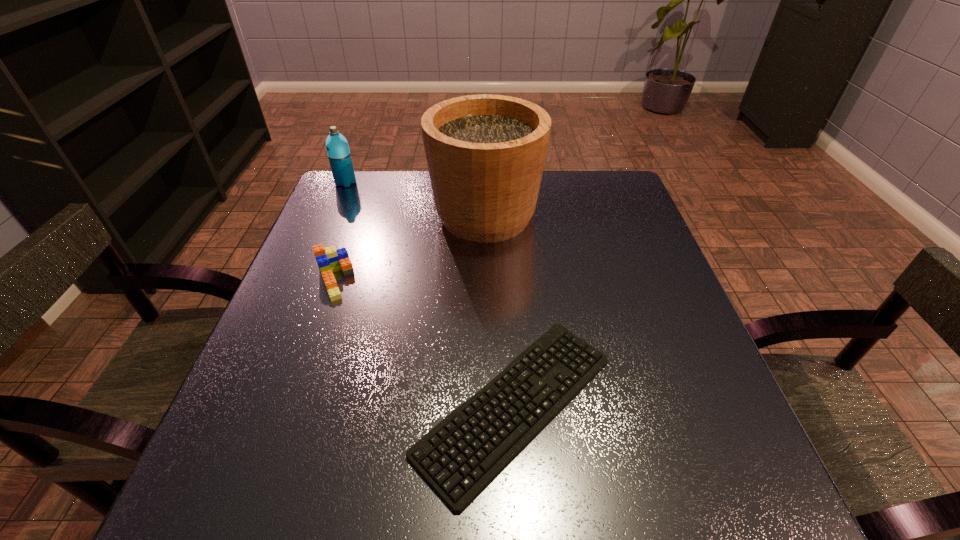
Identify the location of flowerpot. (485, 153).

Locate an element on the screen. Image resolution: width=960 pixels, height=540 pixels. the second tallest object is located at coordinates (337, 147).

You are a GUI agent. You are given a task and a screenshot of the screen. Output one action in this format:
    pyautogui.click(x=<x>, y=<y>)
    Task: Click on the Lego
    
    Given the screenshot: What is the action you would take?
    pyautogui.click(x=329, y=260)

Locate an element on the screen. The image size is (960, 540). the second shortest object is located at coordinates (329, 260).

Where is `the shortest object`? The image size is (960, 540). the shortest object is located at coordinates (459, 457).

Find the location of a particular element. the nearest object is located at coordinates (459, 457).

Find the location of a particular element. free space located on the front of the flowerpot is located at coordinates (487, 338).

Where is `vacant space located 0.360m on the right of the third shortest object`? Image resolution: width=960 pixels, height=540 pixels. vacant space located 0.360m on the right of the third shortest object is located at coordinates (483, 183).

You are a GUI agent. You are given a task and a screenshot of the screen. Output one action in this format:
    pyautogui.click(x=<x>, y=<y>)
    Task: Click on the free space located on the back of the second nearest object
    The height and width of the screenshot is (540, 960).
    Given the screenshot: What is the action you would take?
    pyautogui.click(x=368, y=183)

Locate an element on the screen. free point located 0.090m on the right of the shortest object is located at coordinates (672, 404).